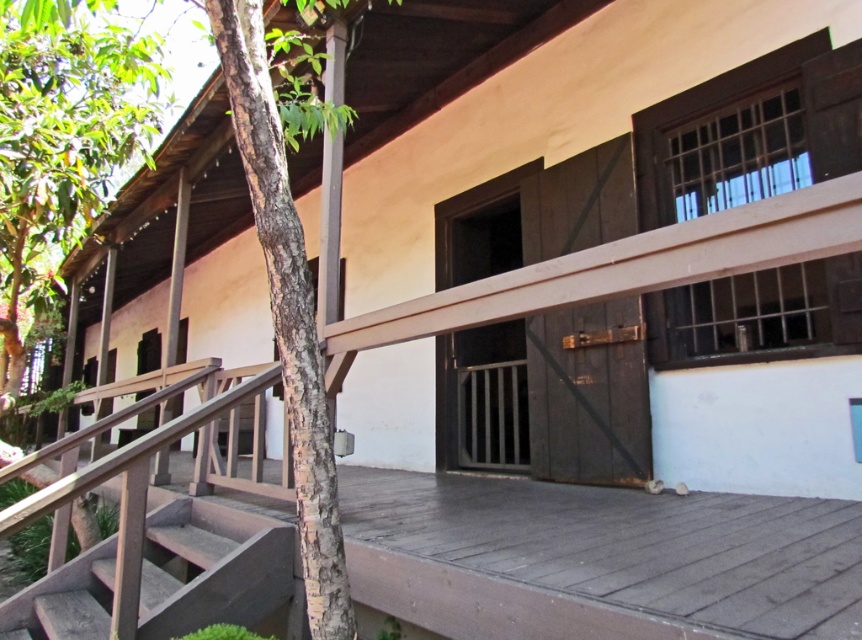
Question: Which point is closer to the camera taking this photo?

Choices:
 (A) (34, 225)
 (B) (348, 596)

Answer: (B)

Question: Which point appears farthest from the camera in this image?

Choices:
 (A) (330, 512)
 (B) (309, 304)
 (C) (255, 602)
 (D) (22, 97)

Answer: (D)

Question: Does brown textured tree at left have a larger size compared to wooden stairs at lower left?

Choices:
 (A) no
 (B) yes

Answer: (B)

Question: Can you confirm if brown rough bark tree at center is positioned to the left of wooden stairs at lower left?

Choices:
 (A) yes
 (B) no

Answer: (B)

Question: Estimate the real-world distances between objects in this image. Which object is closer to the brown textured tree at left?

Choices:
 (A) wooden stairs at lower left
 (B) brown rough bark tree at center
 (C) green leafy tree at left

Answer: (B)

Question: Observing the image, what is the correct spatial positioning of brown rough bark tree at center in reference to wooden stairs at lower left?

Choices:
 (A) left
 (B) right

Answer: (B)